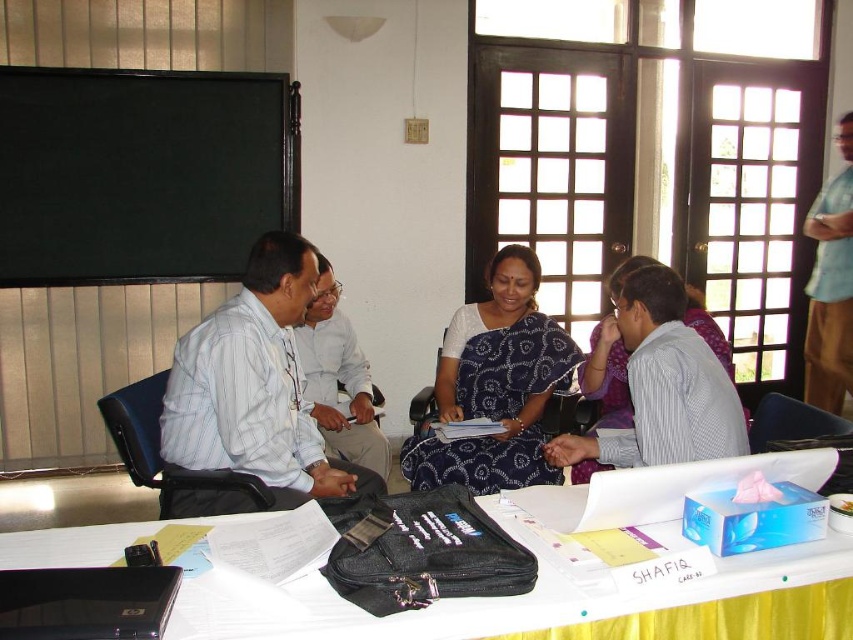
You are standing at the entrance of the room and want to locate the white striped shirt at center. According to the coordinates provided, in which direction should you look relative to the center of the image?

The white striped shirt at center is located at coordinates point (663, 385). Since the x and y coordinates are both greater than 0.5, it is positioned to the right and below the center of the image. Therefore, you should look to the right and downward from the center to find it.

You are standing at the entrance of the room and want to walk directly to the yellow fabric table at lower center. According to the coordinates provided, in which direction should you move from your current position?

The yellow fabric table at lower center is located at coordinates point (563, 598), so you should move towards the lower center direction to reach it.